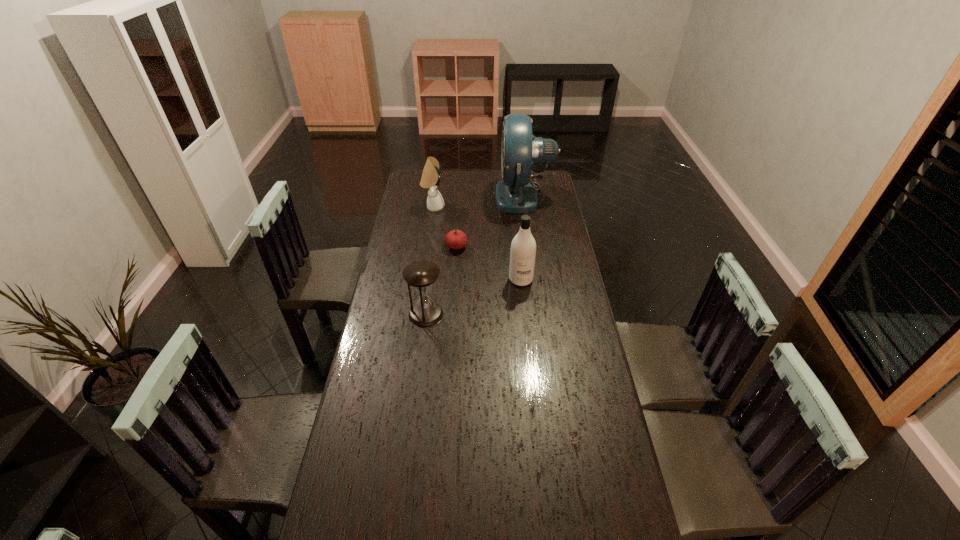
Locate an element on the screen. This screenshot has height=540, width=960. fan is located at coordinates (516, 193).

Identify the location of shampoo. (523, 247).

Identify the location of doll. (430, 179).

Locate an element on the screen. The width and height of the screenshot is (960, 540). the nearest object is located at coordinates (421, 275).

Identify the location of hourglass. The width and height of the screenshot is (960, 540). (421, 275).

The height and width of the screenshot is (540, 960). I want to click on tomato, so click(x=455, y=239).

At what (x,y) coordinates should I click in order to perform the action: click on the third nearest object. Please return your answer as a coordinate pair (x, y). Looking at the image, I should click on (455, 239).

Locate an element on the screen. vacant position located in front of the fan to blow air is located at coordinates (418, 196).

Identify the location of vacant area located 0.210m in front of the fan to blow air. The width and height of the screenshot is (960, 540). (454, 196).

Locate an element on the screen. This screenshot has width=960, height=540. vacant point located 0.120m in front of the fan to blow air is located at coordinates (472, 196).